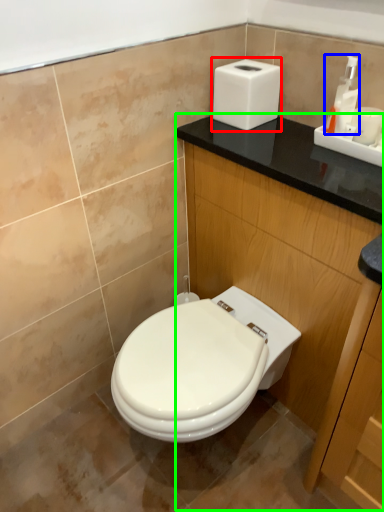
Question: Which object is the farthest from hand dryer (highlighted by a red box)? Choose among these: soap dispenser (highlighted by a blue box) or dresser (highlighted by a green box).

Choices:
 (A) soap dispenser
 (B) dresser

Answer: (B)